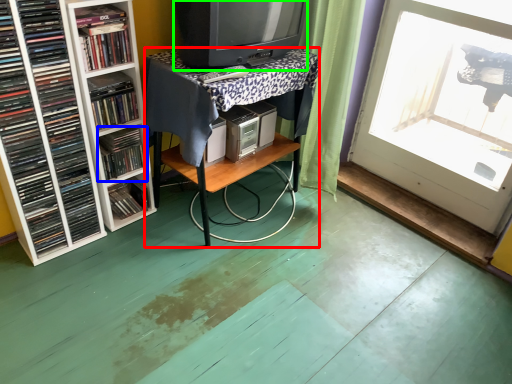
Question: Which is farther away from table (highlighted by a red box)? book (highlighted by a blue box) or television (highlighted by a green box)?

Choices:
 (A) book
 (B) television

Answer: (A)